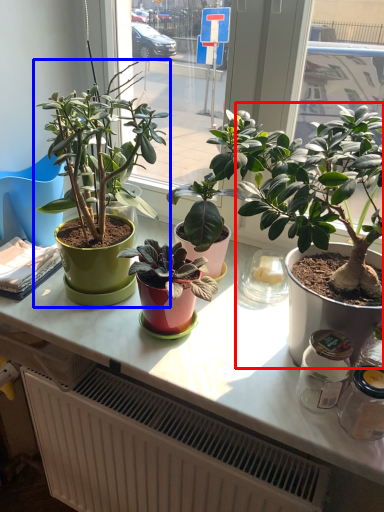
Question: Which point is closer to the camera, houseplant (highlighted by a red box) or houseplant (highlighted by a blue box)?

Choices:
 (A) houseplant
 (B) houseplant

Answer: (A)